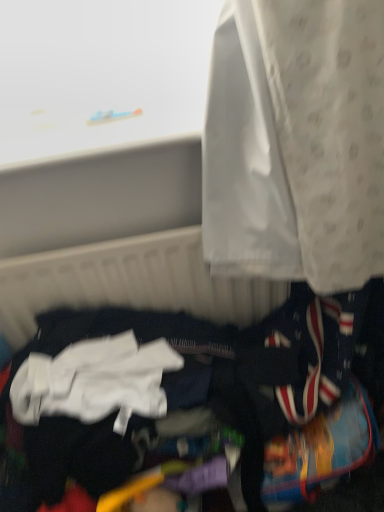
Question: Should I look upward or downward to see white fabric at lower left?

Choices:
 (A) up
 (B) down

Answer: (B)